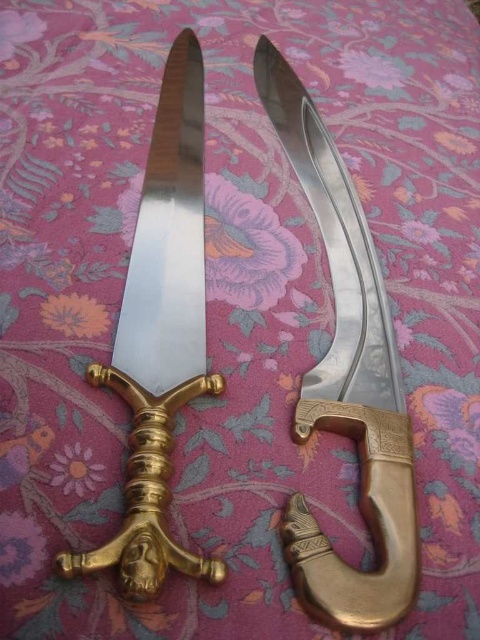
Does polished brass sword at center have a lesser height compared to polished metal knife at center?

In fact, polished brass sword at center may be taller than polished metal knife at center.

Does point (134, 596) come farther from viewer compared to point (172, 60)?

No, it is in front of (172, 60).

Locate an element on the screen. polished brass sword at center is located at coordinates (159, 333).

Which is below, polished brass dagger at center or polished brass sword at center?

Positioned lower is polished brass dagger at center.

Can you confirm if polished brass dagger at center is positioned above polished brass sword at center?

Actually, polished brass dagger at center is below polished brass sword at center.

Between point (383, 420) and point (132, 460), which one is positioned in front?

Positioned in front is point (132, 460).

Find the location of a particular element. The width and height of the screenshot is (480, 640). polished brass dagger at center is located at coordinates (346, 380).

Between polished brass dagger at center and polished metal knife at center, which one has less height?

polished metal knife at center is shorter.

This screenshot has height=640, width=480. I want to click on polished brass dagger at center, so click(x=346, y=380).

Where is `polished brass dagger at center`? The width and height of the screenshot is (480, 640). polished brass dagger at center is located at coordinates (346, 380).